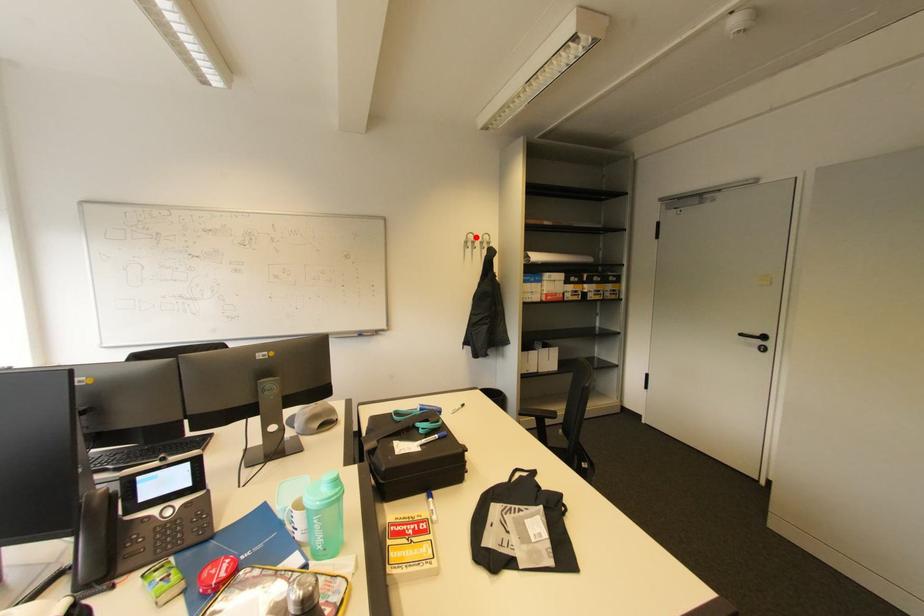
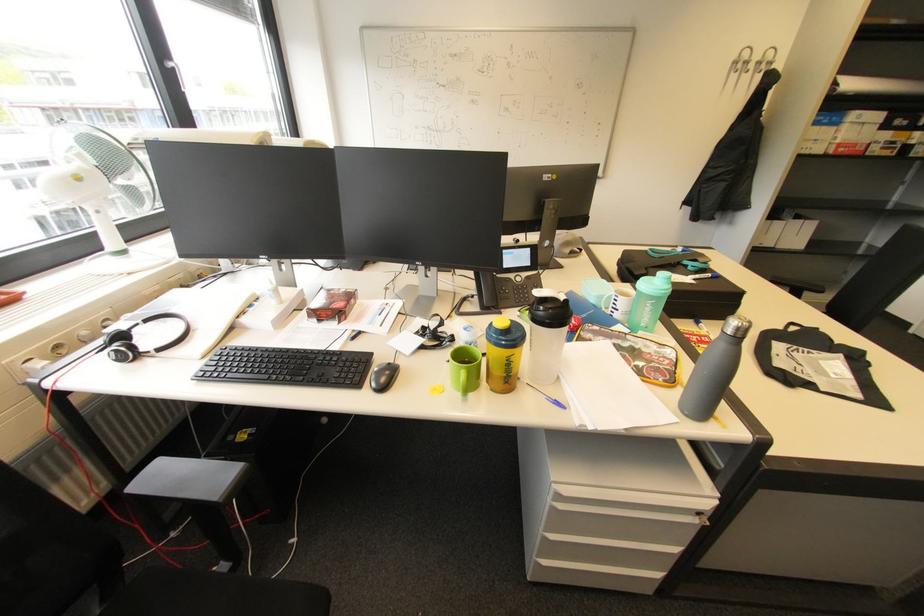
Question: I am providing you with two images of the same scene from different viewpoints. Given a red point in image1, look at the same physical point in image2. Is it:

Choices:
 (A) Closer to the viewpoint
 (B) Farther from the viewpoint

Answer: (B)